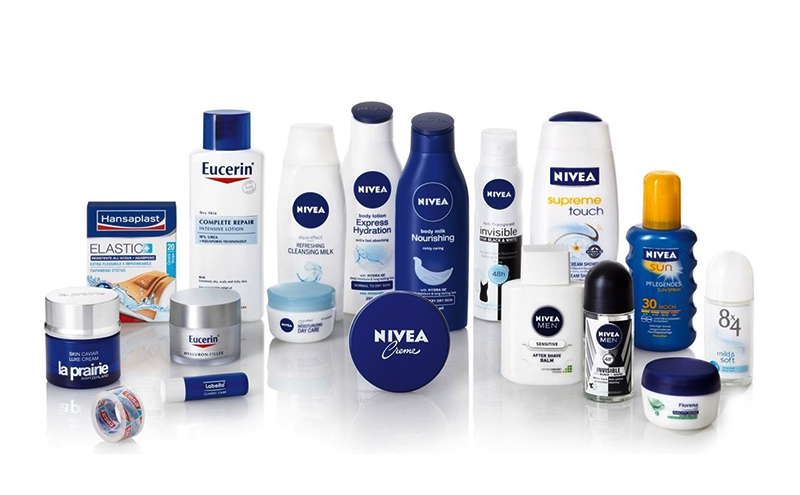
At what (x,y) coordinates should I click in order to perform the action: click on jars. Please return your answer as a coordinate pair (x, y). The width and height of the screenshot is (800, 495). Looking at the image, I should click on (85, 330), (210, 308), (309, 308), (694, 403), (416, 338).